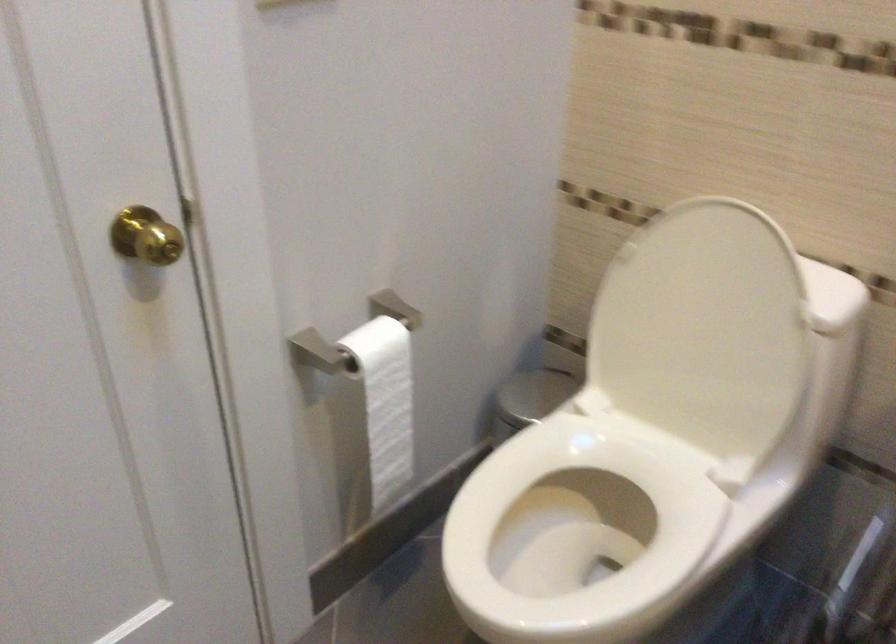
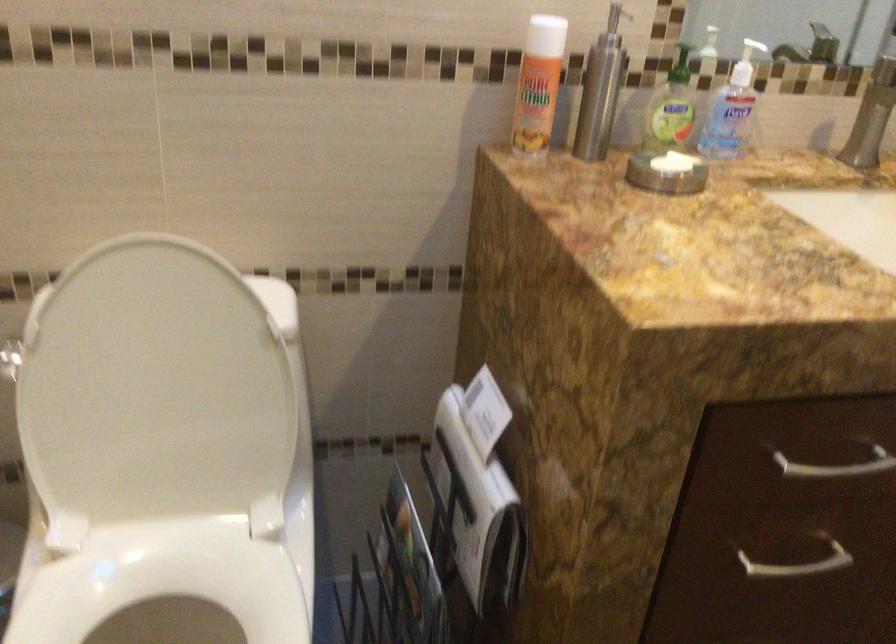
In the second image, find the point that corresponds to [691,325] in the first image.

(152, 391)